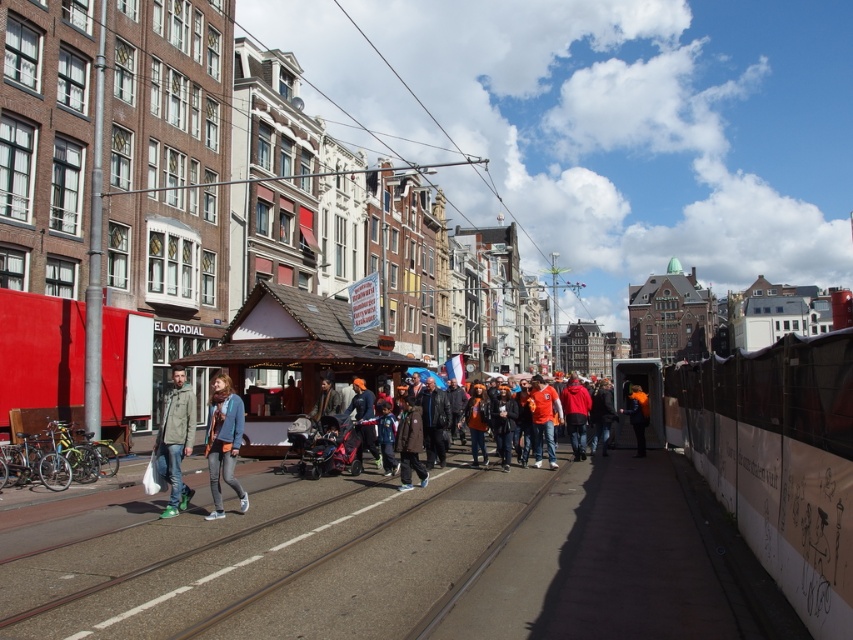
Question: Is orange knit hat at center smaller than orange fabric jacket at center?

Choices:
 (A) no
 (B) yes

Answer: (B)

Question: Among these points, which one is farthest from the camera?

Choices:
 (A) (331, 440)
 (B) (473, 412)
 (C) (541, 428)

Answer: (C)

Question: Does orange knit hat at center appear on the right side of orange leather jacket at center?

Choices:
 (A) no
 (B) yes

Answer: (A)

Question: Does red plastic trolley at center come in front of orange fabric jacket at center?

Choices:
 (A) no
 (B) yes

Answer: (B)

Question: Estimate the real-world distances between objects in this image. Which object is closer to the blue denim jacket at center?

Choices:
 (A) orange leather jacket at center
 (B) dark brown leather jacket at center

Answer: (B)

Question: Which of the following is the farthest from the observer?

Choices:
 (A) (648, 420)
 (B) (328, 397)

Answer: (A)